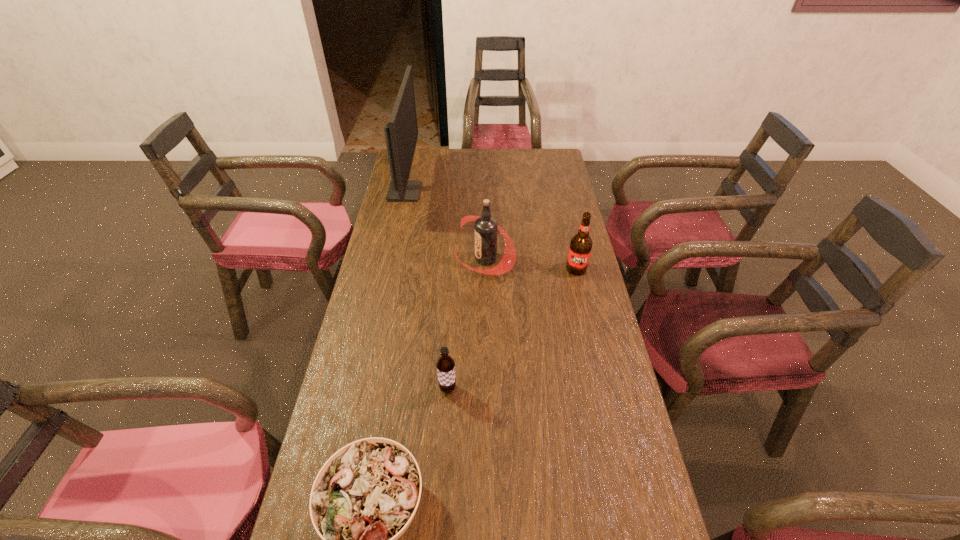
Select which root beer appears as the second closest to the rightmost object. Please provide its 2D coordinates. Your answer should be formatted as a tuple, i.e. [(x, y)], where the tuple contains the x and y coordinates of a point satisfying the conditions above.

[(445, 364)]

I want to click on vacant area that satisfies the following two spatial constraints: 1. on the front-facing side of the rightmost object; 2. on the right side of the computer monitor, so click(388, 269).

At what (x,y) coordinates should I click in order to perform the action: click on free location that satisfies the following two spatial constraints: 1. on the front-facing side of the second nearest object; 2. on the right side of the farthest object. Please return your answer as a coordinate pair (x, y). Looking at the image, I should click on (361, 389).

Locate an element on the screen. The image size is (960, 540). vacant area in the image that satisfies the following two spatial constraints: 1. on the front-facing side of the rightmost root beer; 2. on the right side of the tallest object is located at coordinates (388, 269).